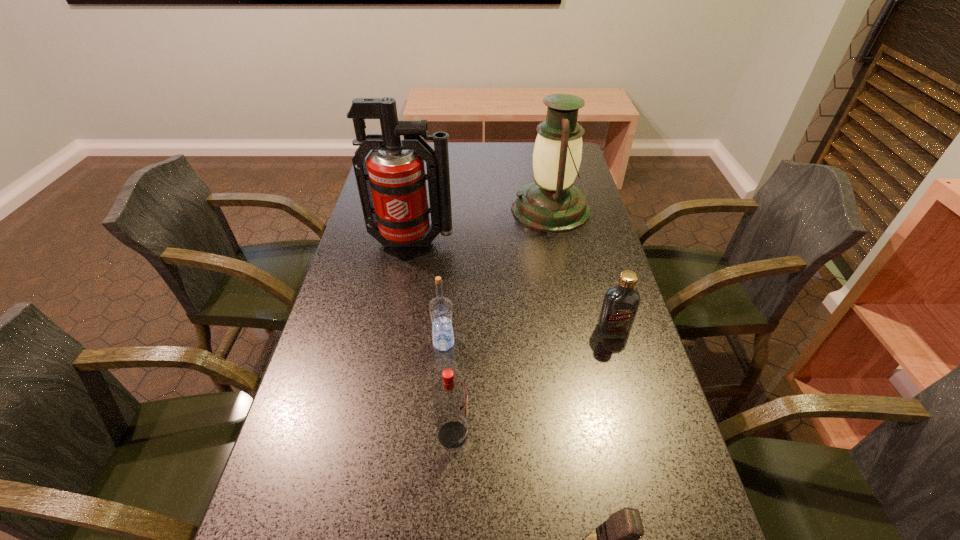
Identify the location of object that is at the left edge. The height and width of the screenshot is (540, 960). [391, 182].

I want to click on lantern that is at the right edge, so click(551, 203).

The image size is (960, 540). Identify the location of vodka situated at the right edge. (620, 305).

You are a GUI agent. You are given a task and a screenshot of the screen. Output one action in this format:
    pyautogui.click(x=<x>, y=<y>)
    Task: Click on the free region at the far edge of the desktop
    The width and height of the screenshot is (960, 540).
    Given the screenshot: What is the action you would take?
    pyautogui.click(x=530, y=145)

At what (x,y) coordinates should I click in order to perform the action: click on blank area at the left edge. Please return your answer as a coordinate pair (x, y). Looking at the image, I should click on (360, 259).

Find the location of `vacant space at the right edge of the desktop`. vacant space at the right edge of the desktop is located at coordinates (663, 500).

Where is `unoccupied position between the nearest vodka and the shortest vodka`? Image resolution: width=960 pixels, height=540 pixels. unoccupied position between the nearest vodka and the shortest vodka is located at coordinates (533, 382).

Find the location of a particular element. This screenshot has width=960, height=540. free space between the lantern and the fire extinguisher is located at coordinates (482, 226).

This screenshot has width=960, height=540. I want to click on empty location between the fire extinguisher and the second tallest object, so click(482, 226).

Identify the location of vacant region between the second tallest object and the fifth farthest object. This screenshot has width=960, height=540. point(502,322).